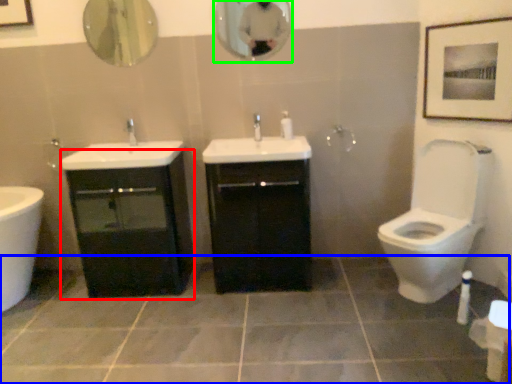
Question: Which object is the farthest from bathroom cabinet (highlighted by a red box)? Choose among these: ceramic tile (highlighted by a blue box) or mirror (highlighted by a green box).

Choices:
 (A) ceramic tile
 (B) mirror

Answer: (B)